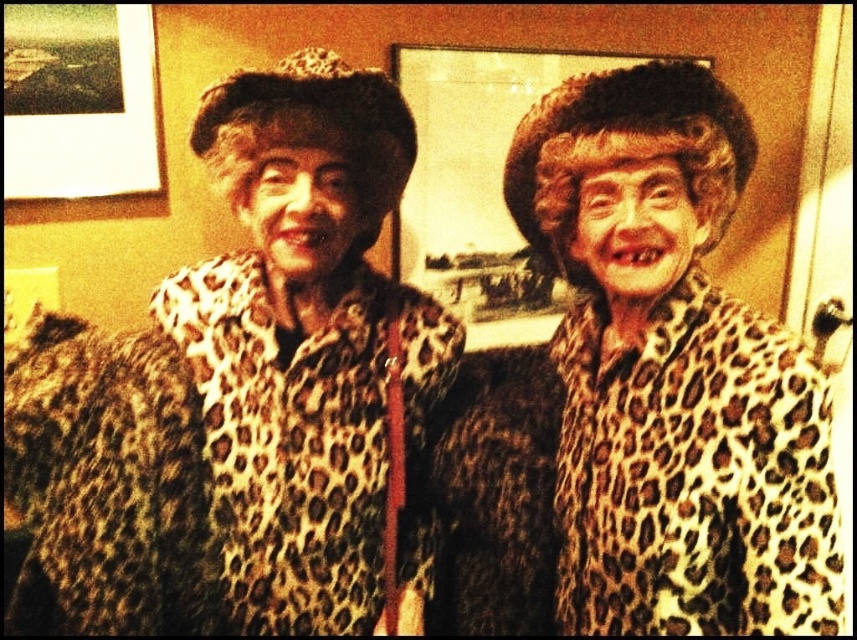
You are an interior designer who wants to ensure that the leopard print coat at center and the matte plastic picture frame at upper center are arranged in a visually balanced composition. Based on their current positions, which object is closer to the left edge of the image?

The leopard print coat at center is positioned on the left side of matte plastic picture frame at upper center, so it is closer to the left edge of the image.

You are trying to decide which leopard print coat to choose for an event. You see both the leopard print coat at center and the leopard print fur coat at center in the image. Based on their positions, which one is on the right side?

The leopard print coat at center is positioned to the right of the leopard print fur coat at center, so the leopard print coat at center is on the right side.